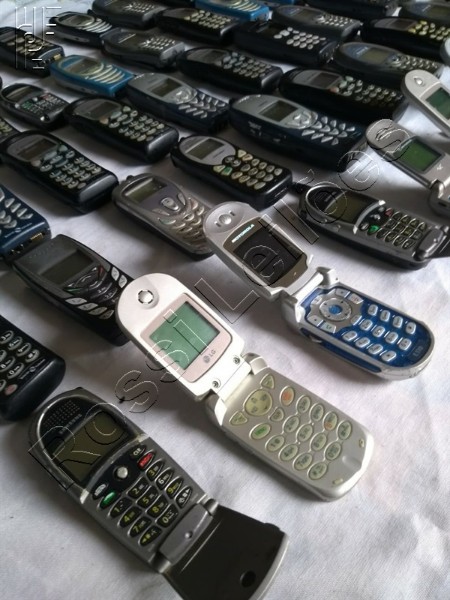
Locate an element on the screen. table cloth is located at coordinates [153, 250].